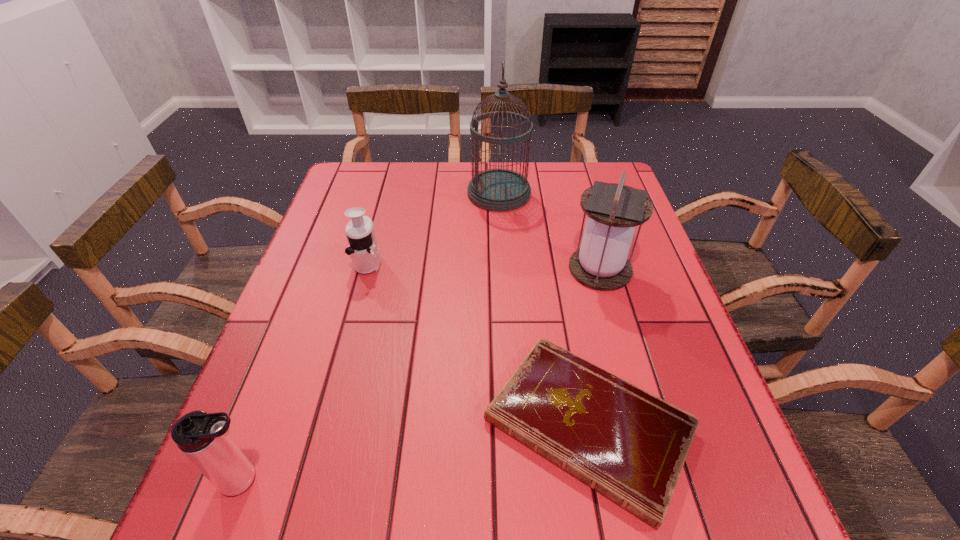
Identify the location of vacant area between the thermos bottle and the second object from left to right. The width and height of the screenshot is (960, 540). (307, 371).

This screenshot has height=540, width=960. I want to click on vacant space that is in between the fourth tallest object and the fourth shortest object, so click(484, 266).

Identify the location of free point between the notebook and the fourth object from right to left. Image resolution: width=960 pixels, height=540 pixels. (478, 344).

You are a GUI agent. You are given a task and a screenshot of the screen. Output one action in this format:
    pyautogui.click(x=<x>, y=<y>)
    Task: Click on the free space between the shortest object and the juicer
    The image size is (960, 540).
    Given the screenshot: What is the action you would take?
    pyautogui.click(x=478, y=344)

This screenshot has width=960, height=540. In order to click on unoccupied position between the thermos bottle and the fourth tallest object in this screenshot , I will do `click(307, 371)`.

The height and width of the screenshot is (540, 960). Find the location of `unoccupied area between the shortest object and the thermos bottle`. unoccupied area between the shortest object and the thermos bottle is located at coordinates (418, 453).

Locate an element on the screen. The height and width of the screenshot is (540, 960). free space between the thermos bottle and the lantern is located at coordinates (423, 375).

At what (x,y) coordinates should I click in order to perform the action: click on free space between the birdcage and the fourth shortest object. Please return your answer as a coordinate pair (x, y). This screenshot has width=960, height=540. Looking at the image, I should click on (549, 231).

Find the location of `free space that is in between the lantern and the shortest object`. free space that is in between the lantern and the shortest object is located at coordinates (594, 347).

Locate an element on the screen. empty space that is in between the shortest object and the second object from left to right is located at coordinates (478, 344).